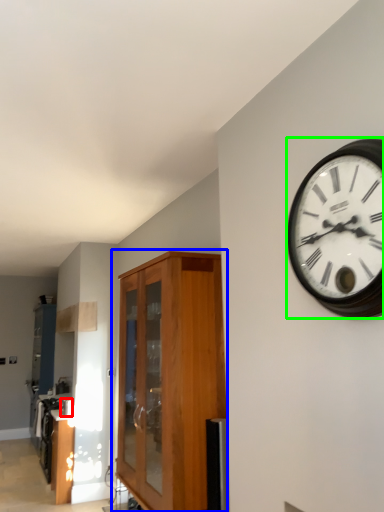
Question: Considering the real-world distances, which object is farthest from appliance (highlighted by a red box)? cabinetry (highlighted by a blue box) or wall clock (highlighted by a green box)?

Choices:
 (A) cabinetry
 (B) wall clock

Answer: (B)